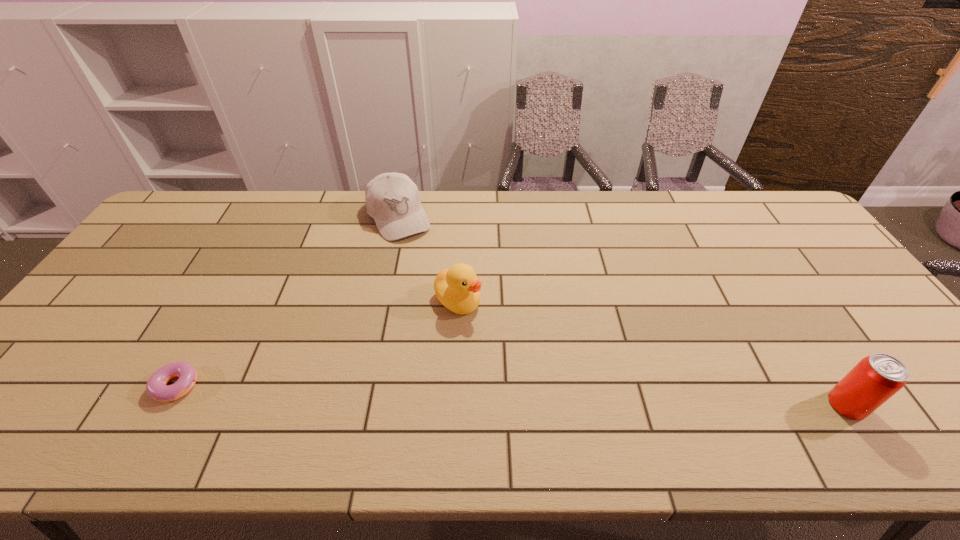
This screenshot has width=960, height=540. Identify the location of vacant area situated at the beak of the third nearest object. (516, 351).

The width and height of the screenshot is (960, 540). Identify the location of vacant space positioned at the beak of the third nearest object. (536, 369).

Locate an element on the screen. The image size is (960, 540). free space located 0.250m on the front-facing side of the third object from right to left is located at coordinates point(439,292).

Locate an element on the screen. vacant space situated 0.270m on the front-facing side of the third object from right to left is located at coordinates 442,296.

The image size is (960, 540). What are the coordinates of `vacant region located 0.300m on the front-facing side of the third object from right to left` in the screenshot? It's located at (445, 303).

The height and width of the screenshot is (540, 960). In order to click on object at the far edge in this screenshot , I will do `click(392, 199)`.

You are a GUI agent. You are given a task and a screenshot of the screen. Output one action in this format:
    pyautogui.click(x=<x>, y=<y>)
    Task: Click on the doughnut present at the near edge
    The image size is (960, 540).
    Given the screenshot: What is the action you would take?
    pyautogui.click(x=156, y=387)

The width and height of the screenshot is (960, 540). Identify the location of can situated at the near edge. (875, 379).

In the image, there is a desktop. Where is `vacant space at the far edge`? The image size is (960, 540). vacant space at the far edge is located at coordinates (320, 234).

The width and height of the screenshot is (960, 540). In the image, there is a desktop. What are the coordinates of `vacant space at the near edge` in the screenshot? It's located at (476, 375).